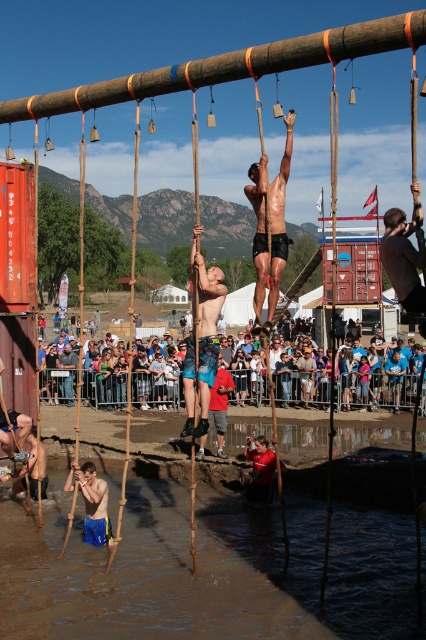
Can you confirm if muddy water at lower center is smaller than matte blue shorts at center?

Actually, muddy water at lower center might be larger than matte blue shorts at center.

Which of these two, muddy water at lower center or matte blue shorts at center, stands shorter?

muddy water at lower center is shorter.

This screenshot has width=426, height=640. What do you see at coordinates (206, 572) in the screenshot? I see `muddy water at lower center` at bounding box center [206, 572].

Where is `muddy water at lower center`? muddy water at lower center is located at coordinates (206, 572).

Who is more forward, (403, 563) or (288, 115)?

Point (288, 115) is more forward.

Is muddy water at lower center positioned behind shiny metallic pole at center?

No, it is not.

Where is `muddy water at lower center`? muddy water at lower center is located at coordinates (206, 572).

Where is `muddy water at lower center`? The image size is (426, 640). muddy water at lower center is located at coordinates (206, 572).

Measure the distance between muddy water at lower center and camera.

They are 11.48 meters apart.

Does muddy water at lower center come in front of matte black crowd at center?

That is True.

Is point (296, 508) behind point (408, 394)?

That is False.

Where is `muddy water at lower center`? muddy water at lower center is located at coordinates (206, 572).